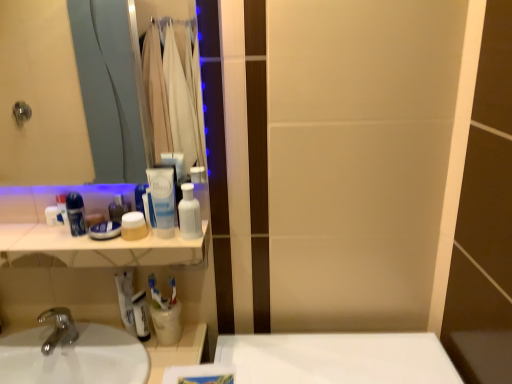
Question: In which direction should I rotate to look at matte beige jar at center, which is the 4th mouthwash from left to right?

Choices:
 (A) left
 (B) right

Answer: (A)

Question: Does blue plastic mouthwash at left, the 7th mouthwash when ordered from right to left, have a smaller size compared to translucent plastic mouthwash at center, the 2th mouthwash when ordered from right to left?

Choices:
 (A) no
 (B) yes

Answer: (B)

Question: Is blue plastic mouthwash at left, which appears as the 1th mouthwash when viewed from the left, closer to the viewer compared to translucent plastic mouthwash at center, the 2th mouthwash when ordered from right to left?

Choices:
 (A) yes
 (B) no

Answer: (B)

Question: Is blue plastic mouthwash at left, the 7th mouthwash when ordered from right to left, far from translucent plastic mouthwash at center, the 2th mouthwash when ordered from right to left?

Choices:
 (A) no
 (B) yes

Answer: (A)

Question: Is blue plastic mouthwash at left, which appears as the 1th mouthwash when viewed from the left, wider than translucent plastic mouthwash at center, acting as the sixth mouthwash starting from the left?

Choices:
 (A) yes
 (B) no

Answer: (B)

Question: Does blue plastic mouthwash at left, the 7th mouthwash when ordered from right to left, come behind translucent plastic mouthwash at center, the 2th mouthwash when ordered from right to left?

Choices:
 (A) yes
 (B) no

Answer: (A)

Question: From the image's perspective, does blue plastic mouthwash at left, which appears as the 1th mouthwash when viewed from the left, appear lower than translucent plastic mouthwash at center, acting as the sixth mouthwash starting from the left?

Choices:
 (A) no
 (B) yes

Answer: (B)

Question: Considering the relative sizes of white glossy counter top at upper left and matte glass mirror at upper left in the image provided, is white glossy counter top at upper left smaller than matte glass mirror at upper left?

Choices:
 (A) no
 (B) yes

Answer: (A)

Question: Can you confirm if white glossy counter top at upper left is thinner than matte glass mirror at upper left?

Choices:
 (A) no
 (B) yes

Answer: (A)

Question: From the image's perspective, is white glossy counter top at upper left beneath matte glass mirror at upper left?

Choices:
 (A) yes
 (B) no

Answer: (A)

Question: Does white glossy counter top at upper left have a greater height compared to matte glass mirror at upper left?

Choices:
 (A) yes
 (B) no

Answer: (B)

Question: Can you confirm if white glossy counter top at upper left is shorter than matte glass mirror at upper left?

Choices:
 (A) yes
 (B) no

Answer: (A)

Question: Is white glossy counter top at upper left not within matte glass mirror at upper left?

Choices:
 (A) no
 (B) yes

Answer: (B)

Question: Is matte beige jar at center, which is counted as the fourth mouthwash, starting from the right, to the left of translucent plastic mouthwash at center, the 2th mouthwash when ordered from right to left, from the viewer's perspective?

Choices:
 (A) yes
 (B) no

Answer: (A)